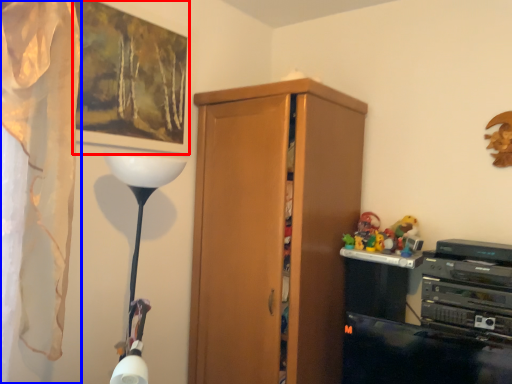
Question: Among these objects, which one is nearest to the camera, picture frame (highlighted by a red box) or curtain (highlighted by a blue box)?

Choices:
 (A) picture frame
 (B) curtain

Answer: (B)